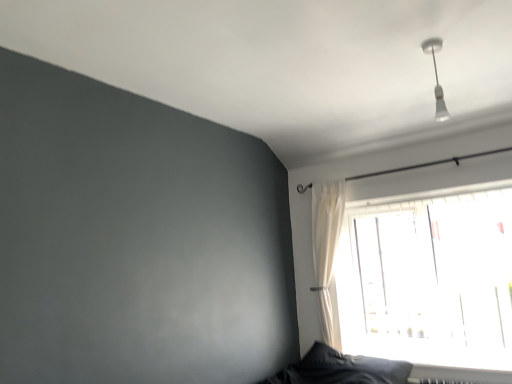
Question: Is white glossy light fixture at upper right thinner than white sheer curtain at upper right?

Choices:
 (A) no
 (B) yes

Answer: (B)

Question: Can you confirm if white glossy light fixture at upper right is positioned to the left of white sheer curtain at upper right?

Choices:
 (A) yes
 (B) no

Answer: (B)

Question: Is the position of white glossy light fixture at upper right more distant than that of white sheer curtain at upper right?

Choices:
 (A) yes
 (B) no

Answer: (B)

Question: Does white glossy light fixture at upper right lie in front of white sheer curtain at upper right?

Choices:
 (A) no
 (B) yes

Answer: (B)

Question: Would you say white glossy light fixture at upper right is a long distance from white sheer curtain at upper right?

Choices:
 (A) no
 (B) yes

Answer: (B)

Question: Is white glossy light fixture at upper right beside white sheer curtain at upper right?

Choices:
 (A) yes
 (B) no

Answer: (B)

Question: Does white sheer curtain at upper right contain transparent glass window at upper right?

Choices:
 (A) no
 (B) yes

Answer: (A)

Question: Are white sheer curtain at upper right and transparent glass window at upper right beside each other?

Choices:
 (A) yes
 (B) no

Answer: (B)

Question: Does white sheer curtain at upper right have a greater width compared to transparent glass window at upper right?

Choices:
 (A) no
 (B) yes

Answer: (B)

Question: Is white sheer curtain at upper right to the right of transparent glass window at upper right from the viewer's perspective?

Choices:
 (A) yes
 (B) no

Answer: (B)

Question: Is white sheer curtain at upper right not close to transparent glass window at upper right?

Choices:
 (A) no
 (B) yes

Answer: (A)

Question: From the image's perspective, is white sheer curtain at upper right located beneath transparent glass window at upper right?

Choices:
 (A) yes
 (B) no

Answer: (B)

Question: Is white glossy light fixture at upper right not near dark gray fabric pillow at lower right?

Choices:
 (A) yes
 (B) no

Answer: (A)